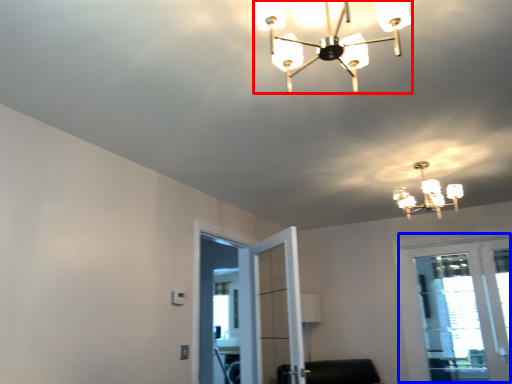
Question: Which of the following is the farthest to the observer, lamp (highlighted by a red box) or window (highlighted by a blue box)?

Choices:
 (A) lamp
 (B) window

Answer: (B)